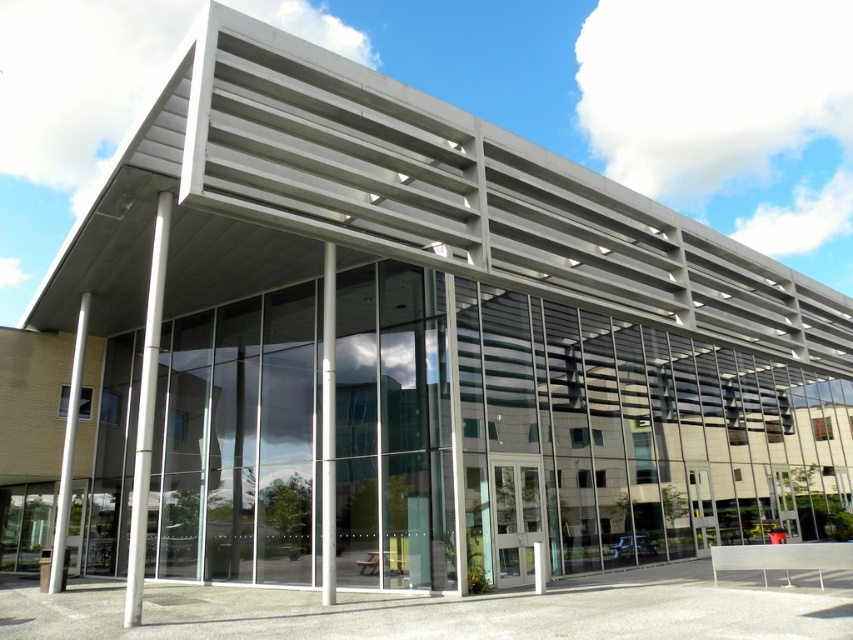
In the scene shown: Is clear glass pillar at center in front of white glossy pole at left?

Yes, clear glass pillar at center is in front of white glossy pole at left.

Between clear glass pillar at center and white glossy pole at left, which one appears on the left side from the viewer's perspective?

Positioned to the left is white glossy pole at left.

In order to click on clear glass pillar at center in this screenshot , I will do `click(328, 428)`.

What are the coordinates of `clear glass pillar at center` in the screenshot? It's located at (328, 428).

Who is shorter, silver metallic pole at left or white glossy pole at left?

With less height is white glossy pole at left.

The image size is (853, 640). I want to click on silver metallic pole at left, so pyautogui.click(x=146, y=413).

Is point (140, 397) behind point (61, 577)?

No, it is in front of (61, 577).

This screenshot has width=853, height=640. What are the coordinates of `silver metallic pole at left` in the screenshot? It's located at (146, 413).

Is silver metallic pole at left to the right of clear glass pillar at center from the viewer's perspective?

Incorrect, silver metallic pole at left is not on the right side of clear glass pillar at center.

Can you confirm if silver metallic pole at left is positioned below clear glass pillar at center?

Correct, silver metallic pole at left is located below clear glass pillar at center.

The width and height of the screenshot is (853, 640). Find the location of `silver metallic pole at left`. silver metallic pole at left is located at coordinates (146, 413).